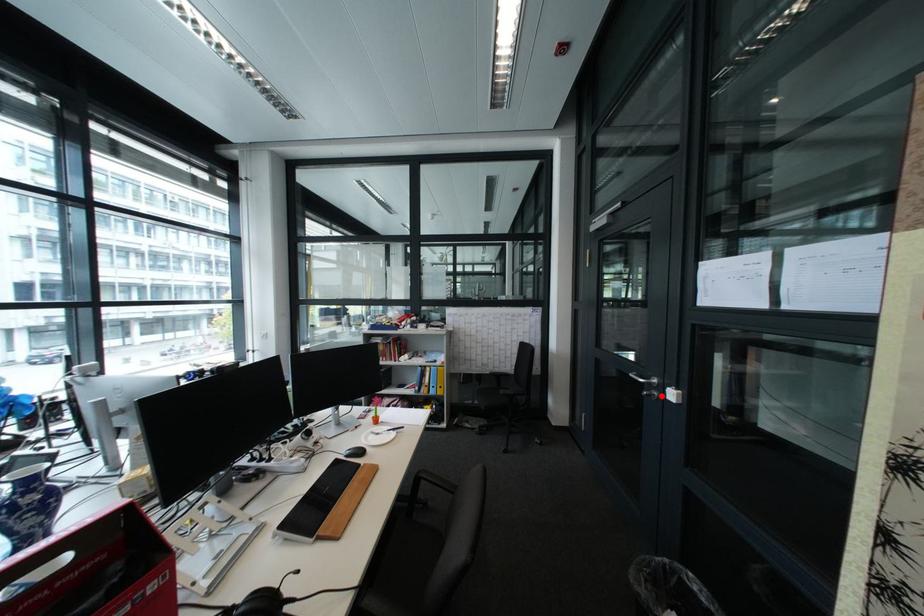
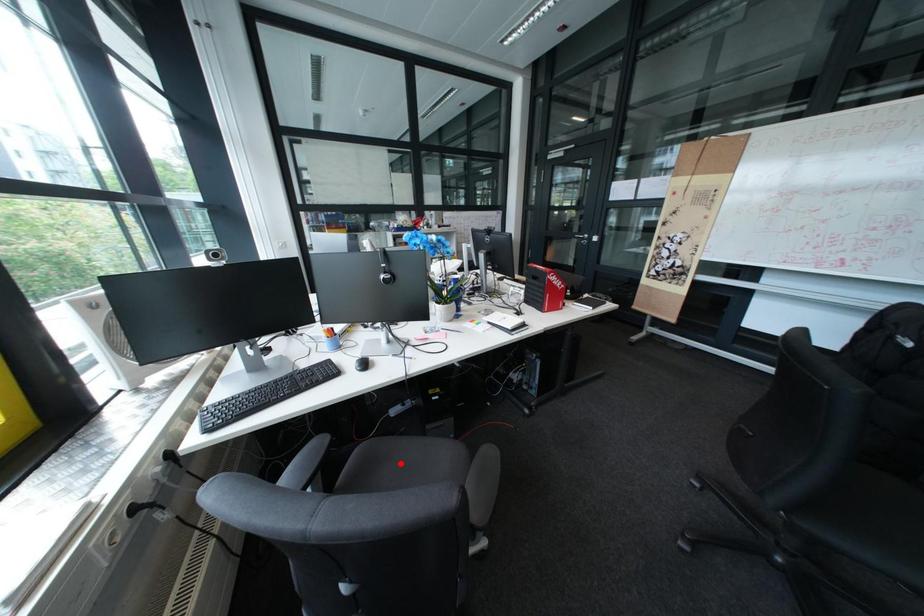
I am providing you with two images of the same scene from different viewpoints. A red point is marked on the first image and another point is marked on the second image. Do the highlighted points in image1 and image2 indicate the same real-world spot?

No